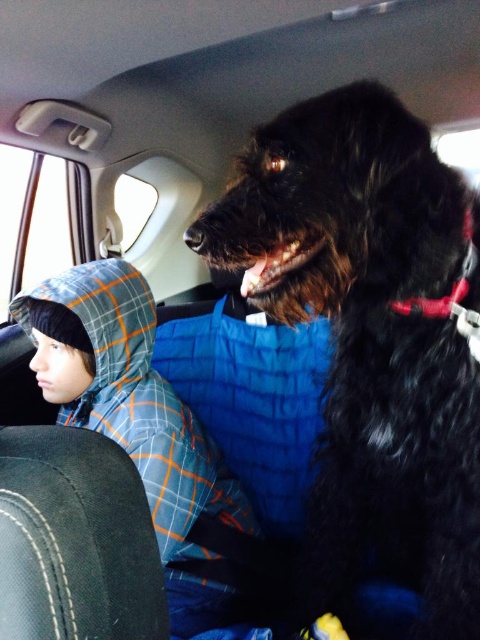
Is black shaggy dog at upper right shorter than blue plaid jacket at center?

Incorrect, black shaggy dog at upper right's height does not fall short of blue plaid jacket at center's.

Can you confirm if black shaggy dog at upper right is thinner than blue plaid jacket at center?

Correct, black shaggy dog at upper right's width is less than blue plaid jacket at center's.

This screenshot has width=480, height=640. Find the location of `black shaggy dog at upper right`. black shaggy dog at upper right is located at coordinates (370, 337).